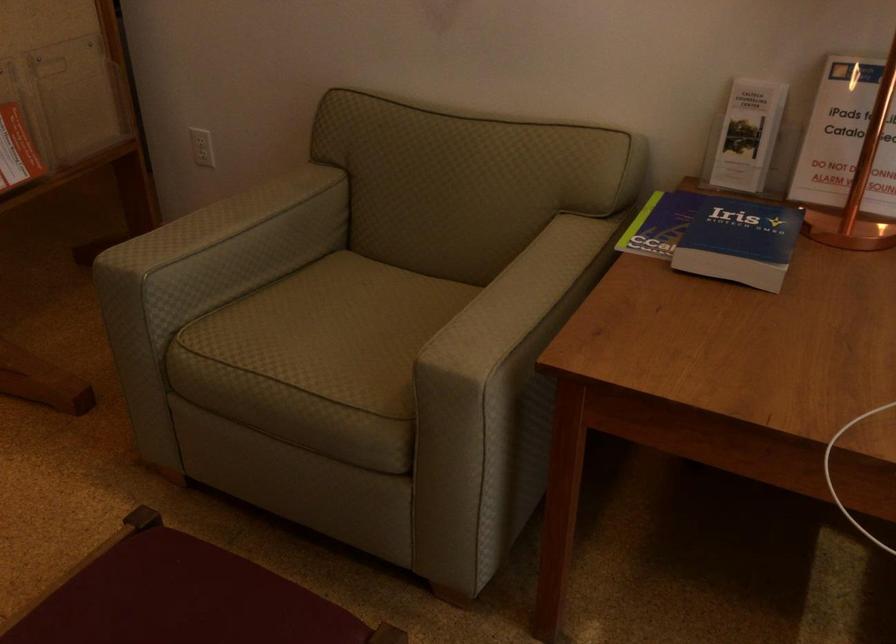
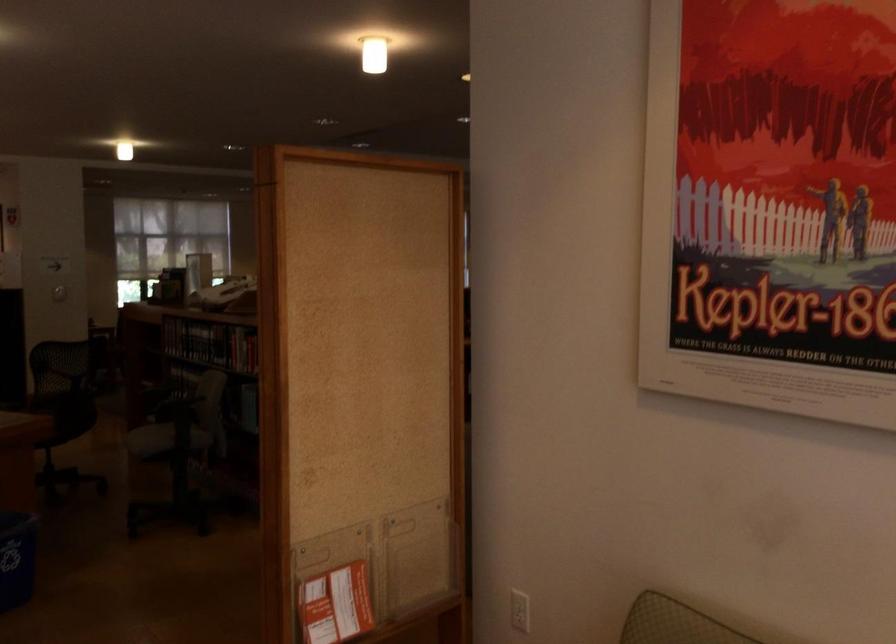
In the second image, find the point that corresponds to point (199, 152) in the first image.

(520, 610)